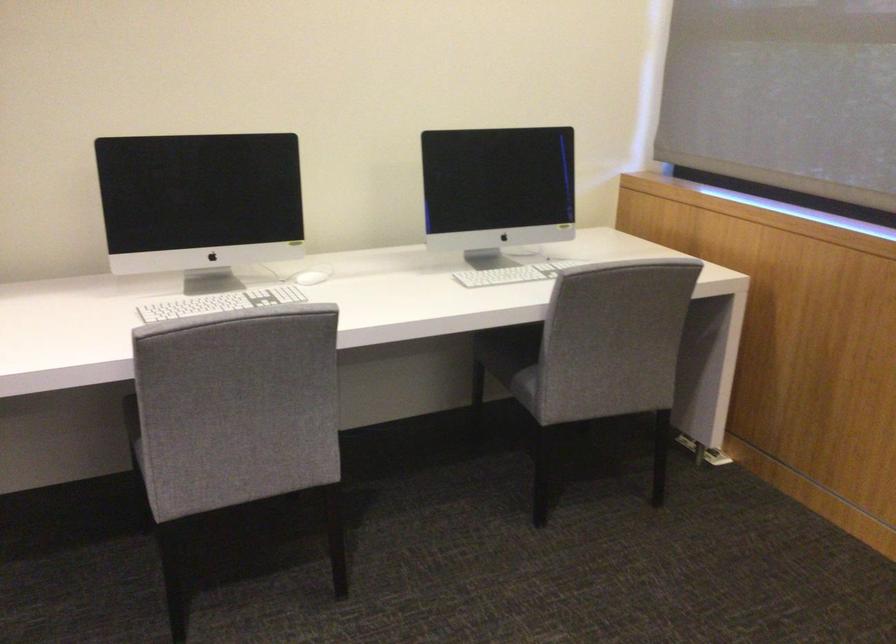
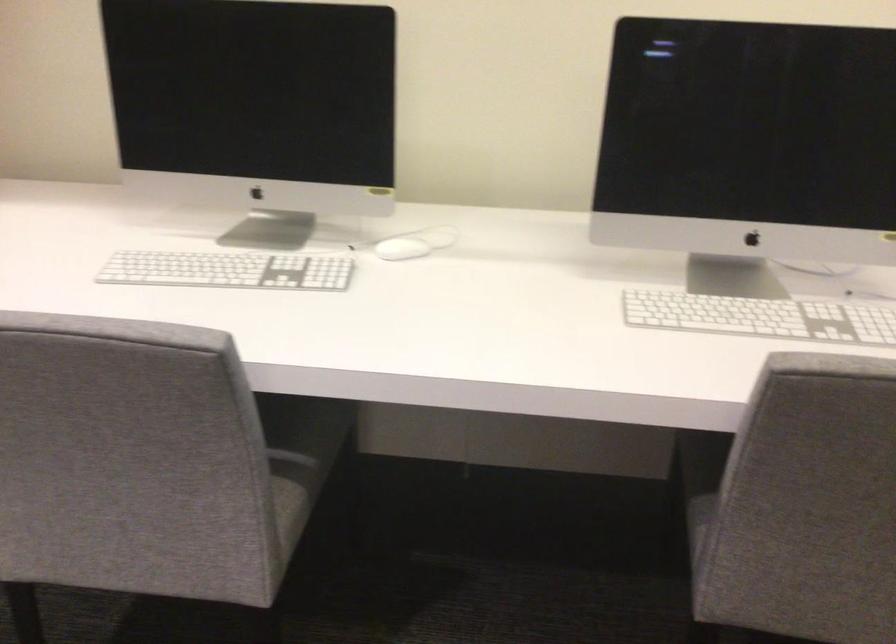
Locate, in the second image, the point that corresponds to point (306, 277) in the first image.

(401, 249)